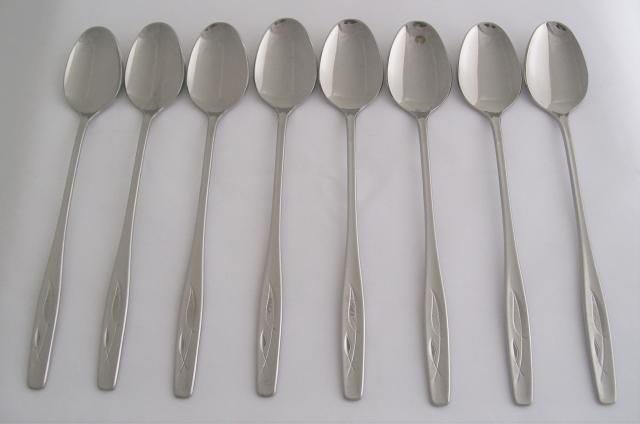
At what (x,y) coordinates should I click in order to perform the action: click on handles. Please return your answer as a coordinate pair (x, y). This screenshot has width=640, height=424. Looking at the image, I should click on (42, 332), (107, 331), (194, 326), (260, 331), (354, 332), (434, 334), (518, 343), (596, 334).